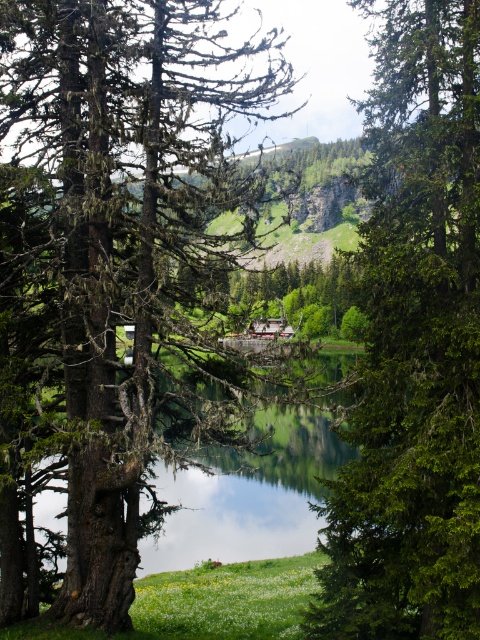
Question: Can you confirm if green mossy tree at left is bigger than green glossy tree at center?

Choices:
 (A) no
 (B) yes

Answer: (B)

Question: Which object appears farthest from the camera in this image?

Choices:
 (A) green mossy tree at left
 (B) green grassy field at lower center

Answer: (B)

Question: Can you confirm if green glossy tree at center is positioned above green grassy field at lower center?

Choices:
 (A) yes
 (B) no

Answer: (A)

Question: Estimate the real-world distances between objects in this image. Which object is closer to the green glossy tree at center?

Choices:
 (A) green mossy tree at left
 (B) green grassy field at lower center

Answer: (A)

Question: Which of the following is the closest to the observer?

Choices:
 (A) green grassy field at lower center
 (B) green glossy tree at center

Answer: (B)

Question: Can you confirm if green glossy tree at center is positioned below green grassy field at lower center?

Choices:
 (A) yes
 (B) no

Answer: (B)